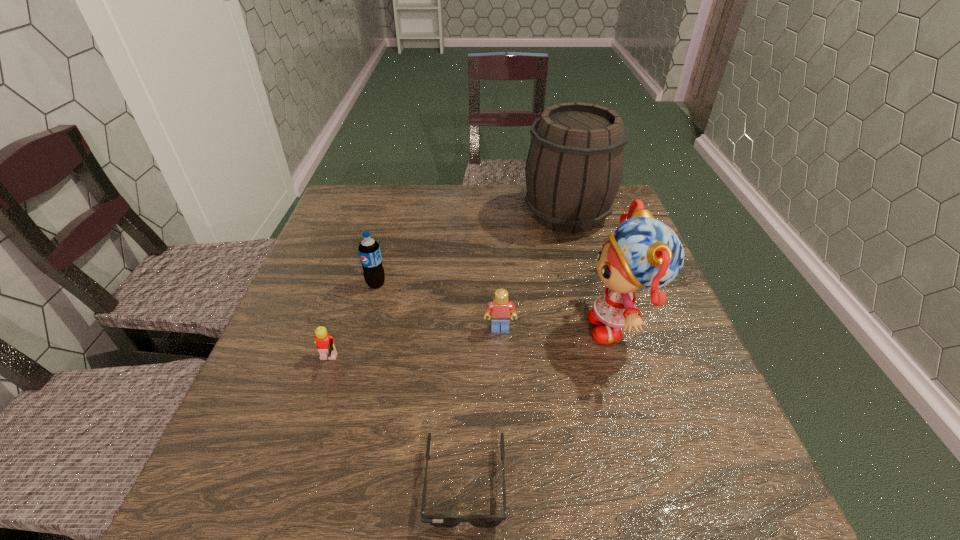
Image resolution: width=960 pixels, height=540 pixels. I want to click on wine bucket that is positioned at the right edge, so click(x=574, y=167).

Locate an element on the screen. Image resolution: width=960 pixels, height=540 pixels. doll at the right edge is located at coordinates (644, 253).

The width and height of the screenshot is (960, 540). In order to click on object located at the far right corner in this screenshot , I will do click(574, 167).

In order to click on vacant space at the far edge of the desktop in this screenshot , I will do `click(479, 196)`.

You are a GUI agent. You are given a task and a screenshot of the screen. Output one action in this format:
    pyautogui.click(x=<x>, y=<y>)
    Task: Click on the vacant space at the near edge of the desktop
    The width and height of the screenshot is (960, 540).
    Given the screenshot: What is the action you would take?
    pyautogui.click(x=587, y=514)

Identify the location of vacant space at the right edge of the desktop. (644, 437).

Locate an element on the screen. free point at the far left corner is located at coordinates (346, 195).

This screenshot has height=540, width=960. Identify the location of vacant area that lies between the farther Lego and the doll. (560, 328).

Image resolution: width=960 pixels, height=540 pixels. I want to click on free space between the sunglasses and the doll, so pos(542,406).

Find the location of a particular element. Image resolution: width=960 pixels, height=540 pixels. free spot between the sunglasses and the wine bucket is located at coordinates [x=516, y=349].